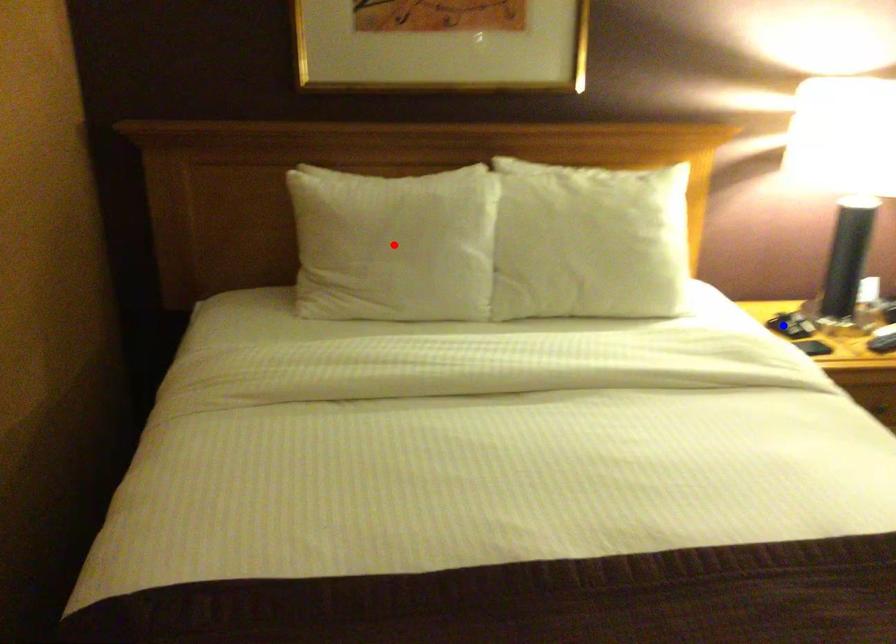
Question: Which of the two points in the image is closer to the camera?

Choices:
 (A) Blue point is closer.
 (B) Red point is closer.

Answer: (B)